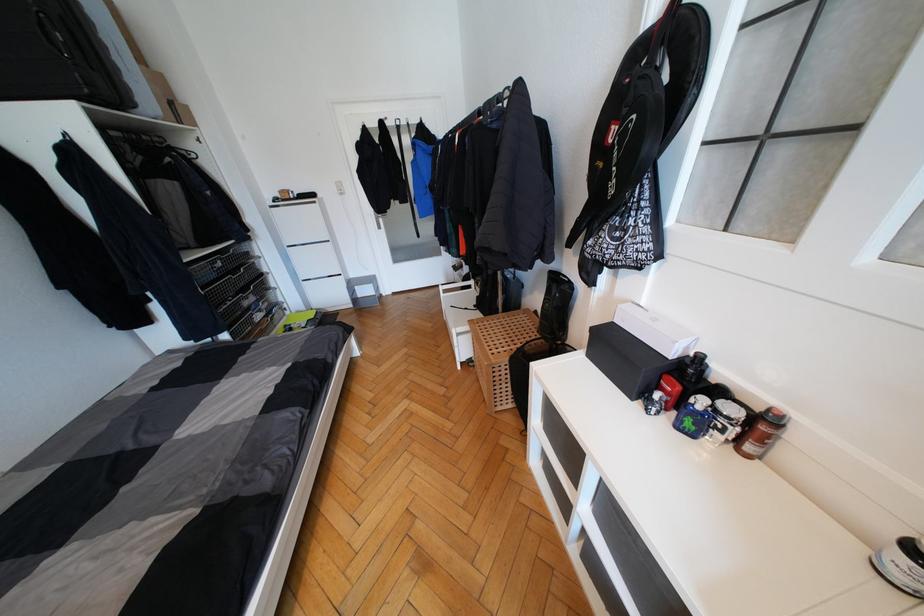
Find where to pull the fabric bin handle. Please return your answer as a coordinate pair (x, y).

(779, 443)